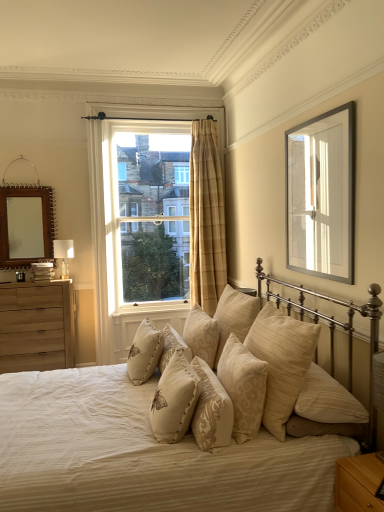
Question: Is point (160, 431) positioned closer to the camera than point (339, 508)?

Choices:
 (A) farther
 (B) closer

Answer: (A)

Question: In terms of height, does beige fabric bed at center look taller or shorter compared to light brown wood nightstand at lower right?

Choices:
 (A) tall
 (B) short

Answer: (A)

Question: Based on their relative distances, which object is nearer to the light brown wood nightstand at lower right?

Choices:
 (A) beige fabric pillow at center, which is the 7th pillow in right-to-left order
 (B) beige embroidered pillow at center, the 6th pillow positioned from the right
 (C) wooden mirror at upper left
 (D) silver metallic picture frame at upper right
 (E) natural wood dresser at left

Answer: (B)

Question: Which object is positioned closest to the beige fabric bed at center?

Choices:
 (A) beige fabric pillow with embroidered moth at center, the 8th pillow when ordered from right to left
 (B) beige textured pillow at center, marked as the 5th pillow in a right-to-left arrangement
 (C) white fabric lampshade at left
 (D) wooden mirror at upper left
 (E) natural wood dresser at left

Answer: (A)